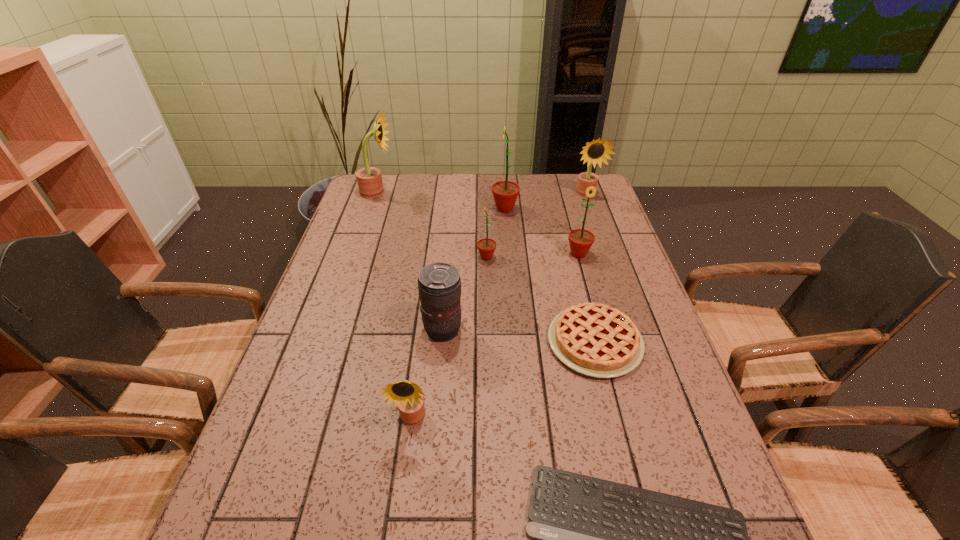
You are a GUI agent. You are given a task and a screenshot of the screen. Output one action in this format:
    pyautogui.click(x=<x>, y=<y>)
    Task: Click on the vacant point at the far right corner
    The image size is (960, 540).
    Given the screenshot: What is the action you would take?
    pyautogui.click(x=575, y=173)

Locate an element on the screen. vacant space that is in between the telephoto lens and the biggest green sunflower is located at coordinates (474, 269).

Where is `empty space between the smallest green sunflower and the tan pie`? The width and height of the screenshot is (960, 540). empty space between the smallest green sunflower and the tan pie is located at coordinates (540, 300).

You are a GUI agent. You are given a task and a screenshot of the screen. Output one action in this format:
    pyautogui.click(x=<x>, y=<y>)
    Task: Click on the free space between the second biggest yellow sunflower and the nearest sunflower
    This screenshot has width=960, height=540.
    Given the screenshot: What is the action you would take?
    pyautogui.click(x=499, y=307)

At what (x,y) coordinates should I click in order to perform the action: click on free space between the leftmost sunflower and the smallest green sunflower. Please return your answer as a coordinate pair (x, y). Looking at the image, I should click on (432, 225).

Identify the location of vacant area between the second shortest object and the telephoto lens. The image size is (960, 540). (519, 336).

The height and width of the screenshot is (540, 960). I want to click on empty space between the leftmost yellow sunflower and the eighth farthest object, so click(395, 306).

Find the location of a particular element. The height and width of the screenshot is (540, 960). vacant area that lies between the telephoto lens and the smallest green sunflower is located at coordinates (465, 294).

Where is `object that is the fourth closest to the rightmost yellow sunflower`? The image size is (960, 540). object that is the fourth closest to the rightmost yellow sunflower is located at coordinates (597, 340).

Identify which object is located as the sixth nearest to the smallest green sunflower. Please provide its 2D coordinates. Your answer should be formatted as a tuple, i.e. [(x, y)], where the tuple contains the x and y coordinates of a point satisfying the conditions above.

[(369, 179)]